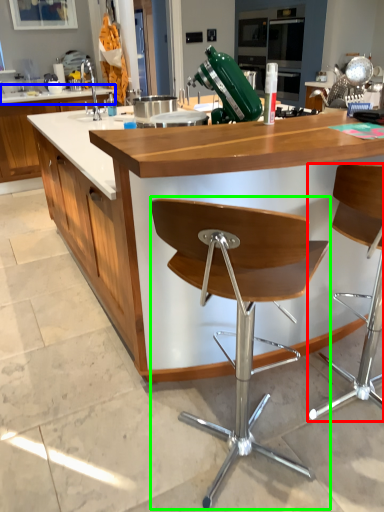
Question: Estimate the real-world distances between objects in this image. Which object is closer to chair (highlighted by a red box), countertop (highlighted by a blue box) or chair (highlighted by a green box)?

Choices:
 (A) countertop
 (B) chair

Answer: (B)